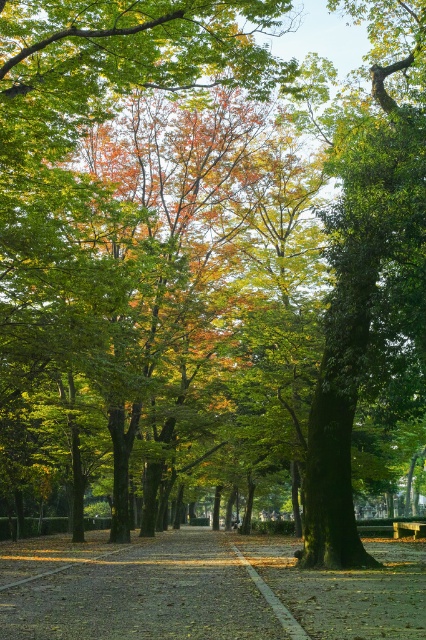
Question: Does white concrete path at center appear on the left side of wooden park bench at center?

Choices:
 (A) yes
 (B) no

Answer: (A)

Question: Which of the following is the farthest from the observer?

Choices:
 (A) dirt path at center
 (B) white concrete path at center
 (C) green mossy tree at center
 (D) wooden park bench at center

Answer: (D)

Question: Among these objects, which one is nearest to the camera?

Choices:
 (A) green mossy tree at center
 (B) dirt path at center
 (C) wooden park bench at center

Answer: (B)

Question: Is white concrete path at center positioned in front of wooden park bench at center?

Choices:
 (A) yes
 (B) no

Answer: (A)

Question: Can you confirm if green mossy tree at center is positioned above dirt path at center?

Choices:
 (A) yes
 (B) no

Answer: (A)

Question: Estimate the real-world distances between objects in this image. Which object is farther from the white concrete path at center?

Choices:
 (A) green mossy tree at center
 (B) dirt path at center
 (C) wooden park bench at center

Answer: (C)